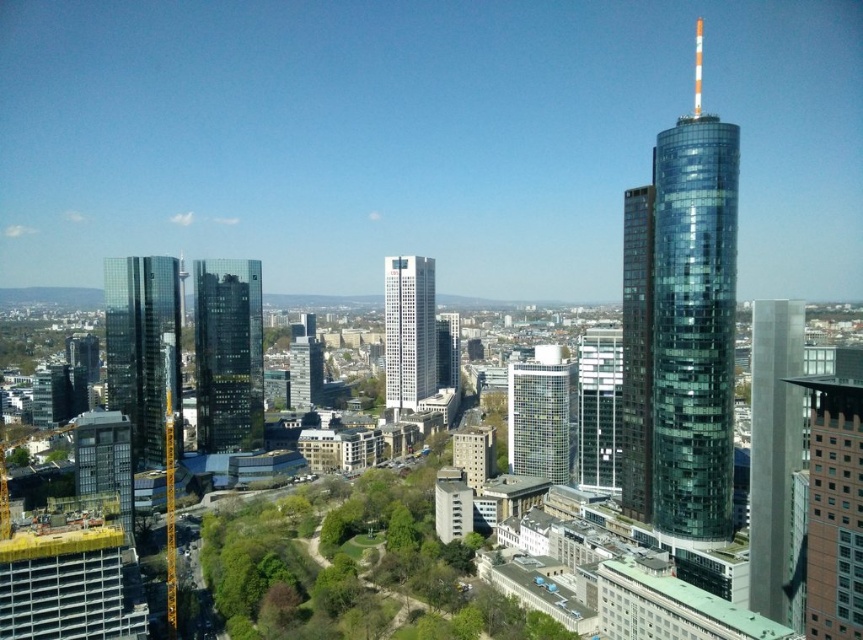
Between point (836, 618) and point (402, 323), which one is positioned in front?

Positioned in front is point (836, 618).

Can you confirm if brown brick building at right is wider than white glass skyscraper at center?

In fact, brown brick building at right might be narrower than white glass skyscraper at center.

At what (x,y) coordinates should I click in order to perform the action: click on brown brick building at right. Please return your answer as a coordinate pair (x, y). The width and height of the screenshot is (863, 640). Looking at the image, I should click on (829, 500).

Does brown brick building at right appear on the right side of shiny glass skyscraper at center-left?

Indeed, brown brick building at right is positioned on the right side of shiny glass skyscraper at center-left.

Is brown brick building at right closer to the viewer compared to shiny glass skyscraper at center-left?

Yes, brown brick building at right is closer to the viewer.

What do you see at coordinates (829, 500) in the screenshot? I see `brown brick building at right` at bounding box center [829, 500].

Where is `brown brick building at right`? The height and width of the screenshot is (640, 863). brown brick building at right is located at coordinates (829, 500).

Who is positioned more to the left, shiny glass skyscraper at center-left or silver glass skyscraper at center?

From the viewer's perspective, shiny glass skyscraper at center-left appears more on the left side.

Does shiny glass skyscraper at center-left appear under silver glass skyscraper at center?

Actually, shiny glass skyscraper at center-left is above silver glass skyscraper at center.

The image size is (863, 640). Describe the element at coordinates (228, 355) in the screenshot. I see `shiny glass skyscraper at center-left` at that location.

This screenshot has height=640, width=863. In order to click on shiny glass skyscraper at center-left in this screenshot , I will do `click(228, 355)`.